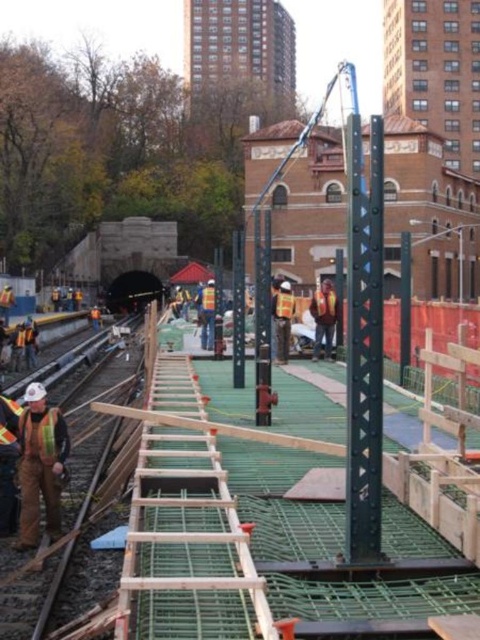
Is green wooden scaffolding at center positioned at the back of reflective orange safety vest at lower left?

That is False.

Is green wooden scaffolding at center bigger than reflective orange safety vest at lower left?

Correct, green wooden scaffolding at center is larger in size than reflective orange safety vest at lower left.

The height and width of the screenshot is (640, 480). What do you see at coordinates (208, 518) in the screenshot? I see `green wooden scaffolding at center` at bounding box center [208, 518].

Where is `green wooden scaffolding at center`? Image resolution: width=480 pixels, height=640 pixels. green wooden scaffolding at center is located at coordinates pyautogui.click(x=208, y=518).

Is green wooden scaffolding at center above reflective safety vest at left?

Yes, green wooden scaffolding at center is above reflective safety vest at left.

What do you see at coordinates (208, 518) in the screenshot? This screenshot has height=640, width=480. I see `green wooden scaffolding at center` at bounding box center [208, 518].

Image resolution: width=480 pixels, height=640 pixels. I want to click on green wooden scaffolding at center, so click(208, 518).

Is reflective safety vest at left bigger than reflective orange safety vest at lower left?

Indeed, reflective safety vest at left has a larger size compared to reflective orange safety vest at lower left.

What do you see at coordinates (40, 465) in the screenshot?
I see `reflective safety vest at left` at bounding box center [40, 465].

What do you see at coordinates (40, 465) in the screenshot?
I see `reflective safety vest at left` at bounding box center [40, 465].

Identify the location of reflective safety vest at left. The image size is (480, 640). (40, 465).